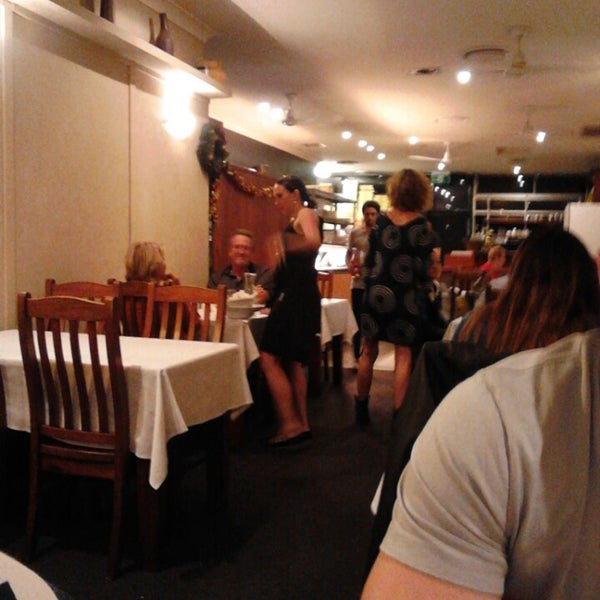
This screenshot has height=600, width=600. I want to click on carpet, so click(x=316, y=558).